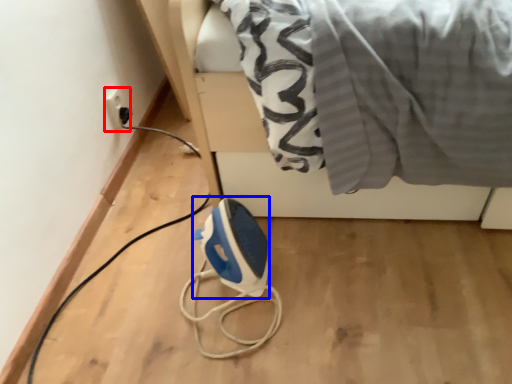
Question: Which object appears closest to the camera in this image, electric outlet (highlighted by a red box) or appliance (highlighted by a blue box)?

Choices:
 (A) electric outlet
 (B) appliance

Answer: (B)